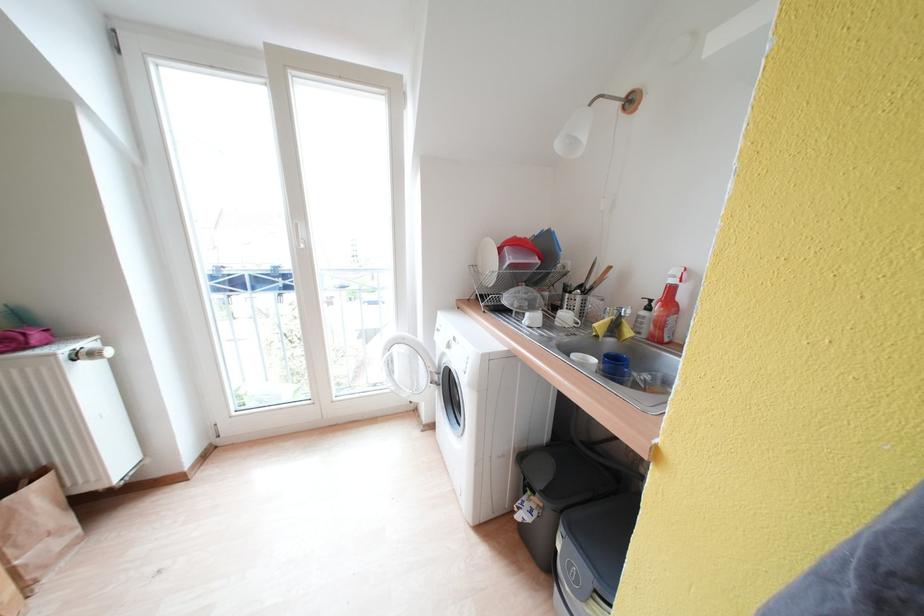
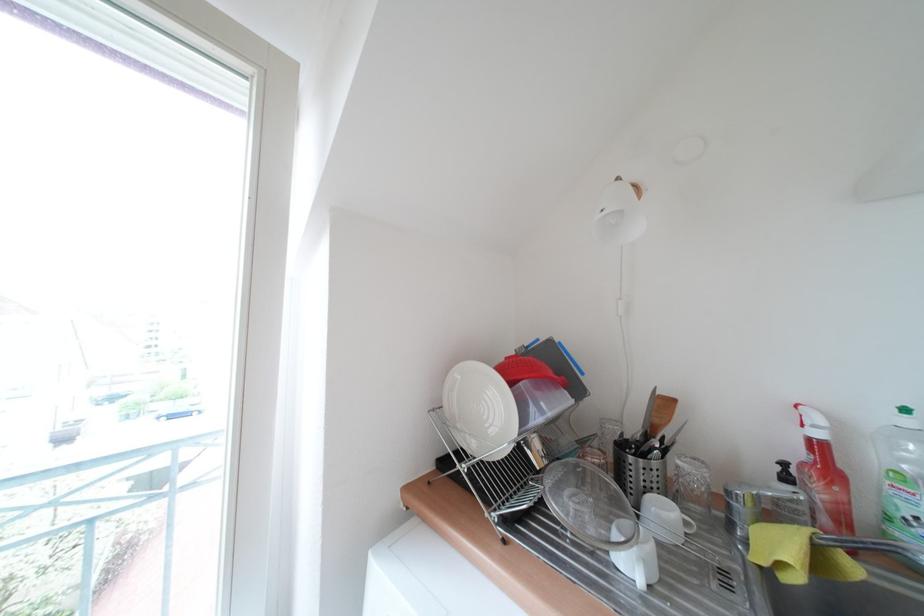
Locate, in the second image, the point that corresponds to the point at 537,322 in the first image.

(651, 567)